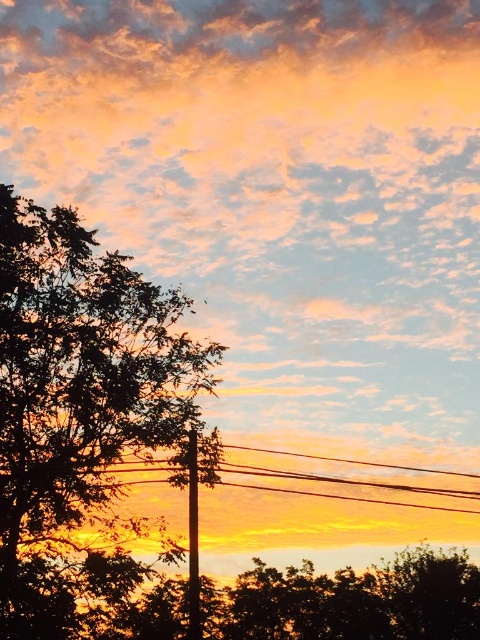
Between green leafy tree at left and black wire at center, which one appears on the left side from the viewer's perspective?

From the viewer's perspective, green leafy tree at left appears more on the left side.

Measure the distance from green leafy tree at left to black wire at center.

A distance of 8.98 feet exists between green leafy tree at left and black wire at center.

The image size is (480, 640). Find the location of `green leafy tree at left`. green leafy tree at left is located at coordinates (84, 420).

Where is `green leafy tree at left`? The height and width of the screenshot is (640, 480). green leafy tree at left is located at coordinates (84, 420).

Is black wire at center taller than smooth black pole at center?

Incorrect, black wire at center's height is not larger of smooth black pole at center's.

Does black wire at center have a smaller size compared to smooth black pole at center?

No.

Is point (156, 481) less distant than point (189, 536)?

No, it is not.

At what (x,y) coordinates should I click in order to perform the action: click on black wire at center. Please return your answer as a coordinate pair (x, y). This screenshot has width=480, height=640. Looking at the image, I should click on pyautogui.click(x=346, y=481).